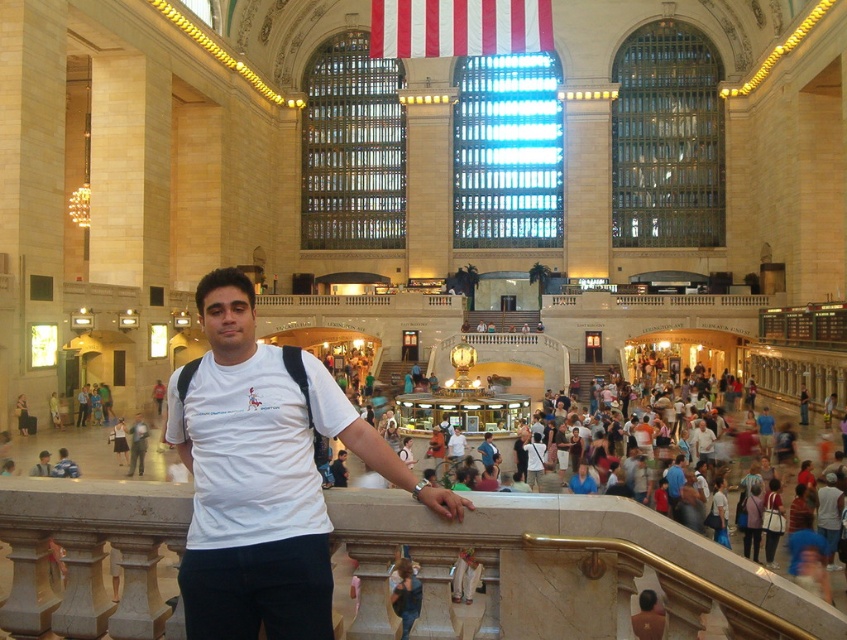
You are standing in the train station and want to determine which of the two points, point (227, 317) or point (535, 10), is closer to you. Based on the scene description, which point is nearer?

Point (227, 317) is closer to the camera than point (535, 10), so it is the nearer point.